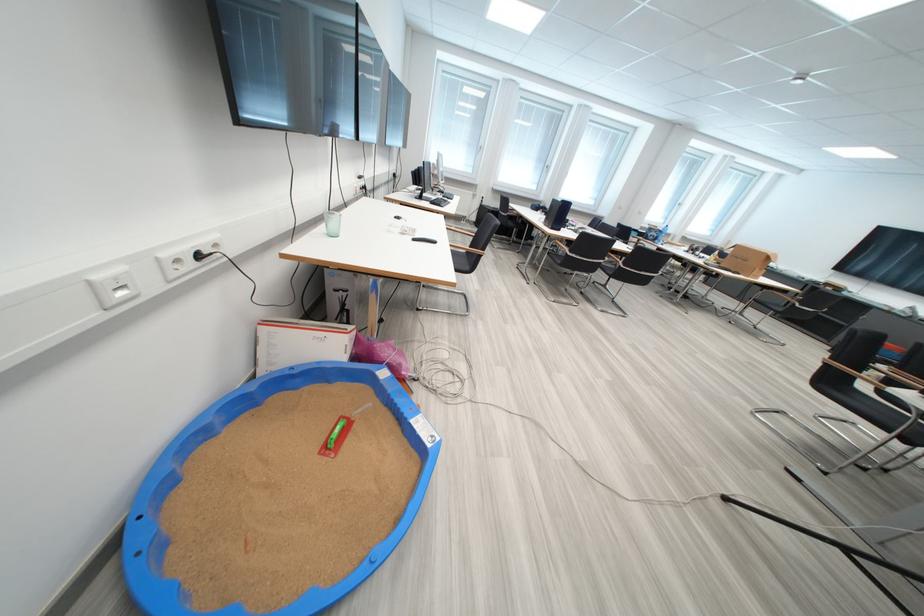
Image resolution: width=924 pixels, height=616 pixels. What are the coordinates of `red toy shovel` in the screenshot? It's located at (339, 432).